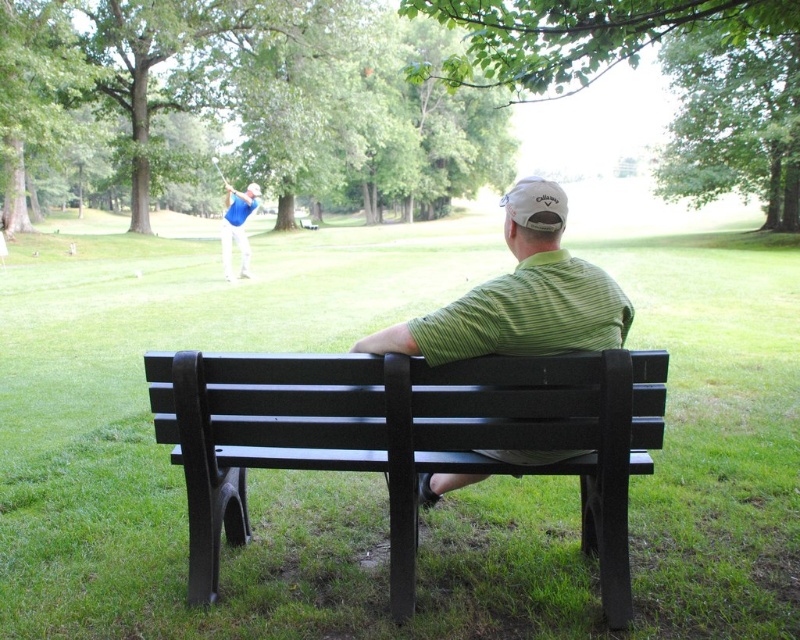
Question: Is green striped shirt at center smaller than blue fabric shirt at upper center?

Choices:
 (A) no
 (B) yes

Answer: (B)

Question: Which object is the closest to the black plastic bench at center?

Choices:
 (A) green striped shirt at center
 (B) green grass at center

Answer: (A)

Question: Among these points, which one is nearest to the camera?

Choices:
 (A) (564, 298)
 (B) (222, 240)
 (C) (752, 323)
 (D) (350, 380)

Answer: (D)

Question: Estimate the real-world distances between objects in this image. Which object is farther from the green striped shirt at center?

Choices:
 (A) green grass at center
 (B) blue fabric shirt at upper center
 (C) black plastic bench at center

Answer: (B)

Question: Does green striped shirt at center have a larger size compared to blue fabric shirt at upper center?

Choices:
 (A) yes
 (B) no

Answer: (B)

Question: Is the position of green striped shirt at center more distant than that of blue fabric shirt at upper center?

Choices:
 (A) yes
 (B) no

Answer: (B)